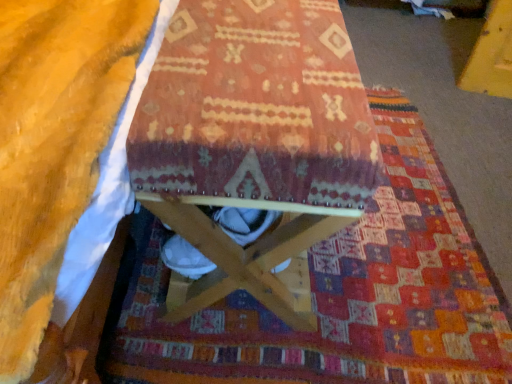
Describe the element at coordinates (333, 294) in the screenshot. The width and height of the screenshot is (512, 384). I see `textured woolen mat at center` at that location.

Identify the location of textured woolen mat at center. 333,294.

Can you confirm if wooden stool at center is bigger than textured woolen mat at center?

Yes, wooden stool at center is bigger than textured woolen mat at center.

Relative to textured woolen mat at center, is wooden stool at center in front or behind?

wooden stool at center is in front of textured woolen mat at center.

Consider the image. Is the surface of wooden stool at center in direct contact with textured woolen mat at center?

No.

In the scene shown: Can you confirm if wooden stool at center is positioned to the left of textured woolen mat at center?

Yes, wooden stool at center is to the left of textured woolen mat at center.

Based on their positions, is soft yellow blanket at lower left located to the left or right of textured woolen mat at center?

In the image, soft yellow blanket at lower left appears on the left side of textured woolen mat at center.

Is soft yellow blanket at lower left not within textured woolen mat at center?

That's correct, soft yellow blanket at lower left is outside of textured woolen mat at center.

Does soft yellow blanket at lower left have a smaller size compared to textured woolen mat at center?

Indeed, soft yellow blanket at lower left has a smaller size compared to textured woolen mat at center.

Is textured woolen mat at center at the back of soft yellow blanket at lower left?

No, soft yellow blanket at lower left's orientation is not away from textured woolen mat at center.

Is textured woolen mat at center closer to the viewer compared to wooden stool at center?

No, textured woolen mat at center is behind wooden stool at center.

Is textured woolen mat at center situated inside wooden stool at center or outside?

textured woolen mat at center cannot be found inside wooden stool at center.

In the image, is textured woolen mat at center on the left side or the right side of wooden stool at center?

textured woolen mat at center is positioned on wooden stool at center's right side.

How many degrees apart are the facing directions of textured woolen mat at center and wooden stool at center?

0.276 degrees separate the facing orientations of textured woolen mat at center and wooden stool at center.

Is wooden stool at center inside or outside of soft yellow blanket at lower left?

wooden stool at center exists outside the volume of soft yellow blanket at lower left.

Is wooden stool at center behind soft yellow blanket at lower left?

Yes, it is.

Based on the photo, is wooden stool at center to the left or to the right of soft yellow blanket at lower left in the image?

Based on their positions, wooden stool at center is located to the right of soft yellow blanket at lower left.

How different are the orientations of wooden stool at center and soft yellow blanket at lower left in degrees?

They differ by 1.13 degrees in their facing directions.

Based on the photo, from the image's perspective, which is below, soft yellow blanket at lower left or wooden stool at center?

wooden stool at center.

Which object is wider, soft yellow blanket at lower left or wooden stool at center?

With larger width is soft yellow blanket at lower left.

In the scene shown: Is soft yellow blanket at lower left oriented towards wooden stool at center?

Yes.

Does soft yellow blanket at lower left come behind wooden stool at center?

No, it is not.

Which is in front, textured woolen mat at center or soft yellow blanket at lower left?

soft yellow blanket at lower left is closer to the camera.

Which is behind, point (322, 363) or point (2, 373)?

Point (322, 363)

Is textured woolen mat at center oriented towards soft yellow blanket at lower left?

No, textured woolen mat at center is not aimed at soft yellow blanket at lower left.

In terms of height, does textured woolen mat at center look taller or shorter compared to soft yellow blanket at lower left?

textured woolen mat at center is shorter than soft yellow blanket at lower left.

Find the location of a particular element. The image size is (512, 384). furniture that appears in front of the textured woolen mat at center is located at coordinates (254, 136).

At what (x,y) coordinates should I click in order to perform the action: click on blanket above the textured woolen mat at center (from the image's perspective). Please return your answer as a coordinate pair (x, y). The image size is (512, 384). Looking at the image, I should click on (53, 144).

Looking at this image, when comparing their distances from wooden stool at center, does textured woolen mat at center or soft yellow blanket at lower left seem further?

Among the two, textured woolen mat at center is located further to wooden stool at center.

From the image, which object appears to be nearer to textured woolen mat at center, wooden stool at center or soft yellow blanket at lower left?

The object closer to textured woolen mat at center is wooden stool at center.

Estimate the real-world distances between objects in this image. Which object is closer to wooden stool at center, soft yellow blanket at lower left or textured woolen mat at center?

soft yellow blanket at lower left lies closer to wooden stool at center than the other object.

From the image, which object appears to be nearer to soft yellow blanket at lower left, wooden stool at center or textured woolen mat at center?

Among the two, wooden stool at center is located nearer to soft yellow blanket at lower left.

From the picture: Based on their spatial positions, is soft yellow blanket at lower left or wooden stool at center closer to textured woolen mat at center?

The object closer to textured woolen mat at center is wooden stool at center.

Looking at the image, which one is located closer to soft yellow blanket at lower left, textured woolen mat at center or wooden stool at center?

Among the two, wooden stool at center is located nearer to soft yellow blanket at lower left.

Locate an element on the screen. furniture between soft yellow blanket at lower left and textured woolen mat at center from left to right is located at coordinates (254, 136).